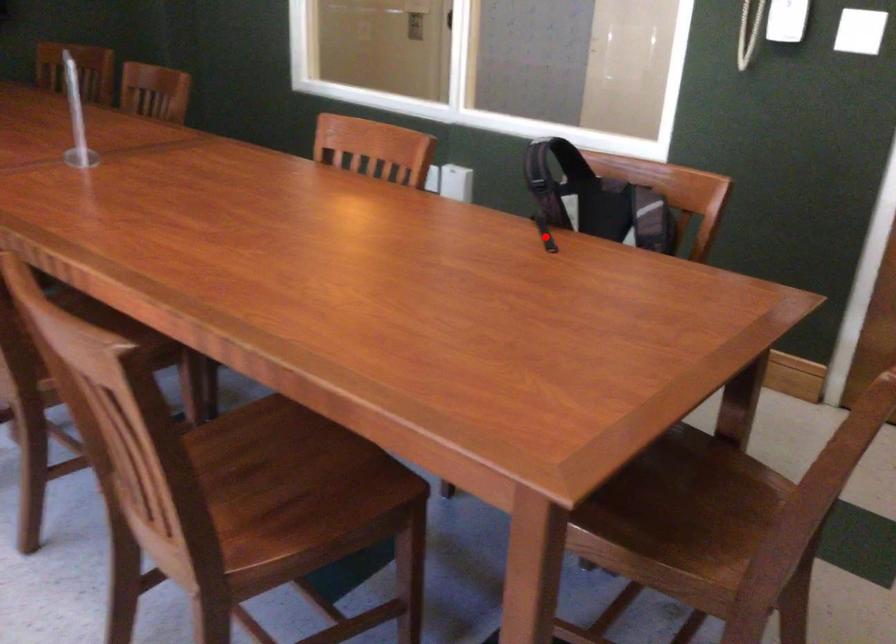
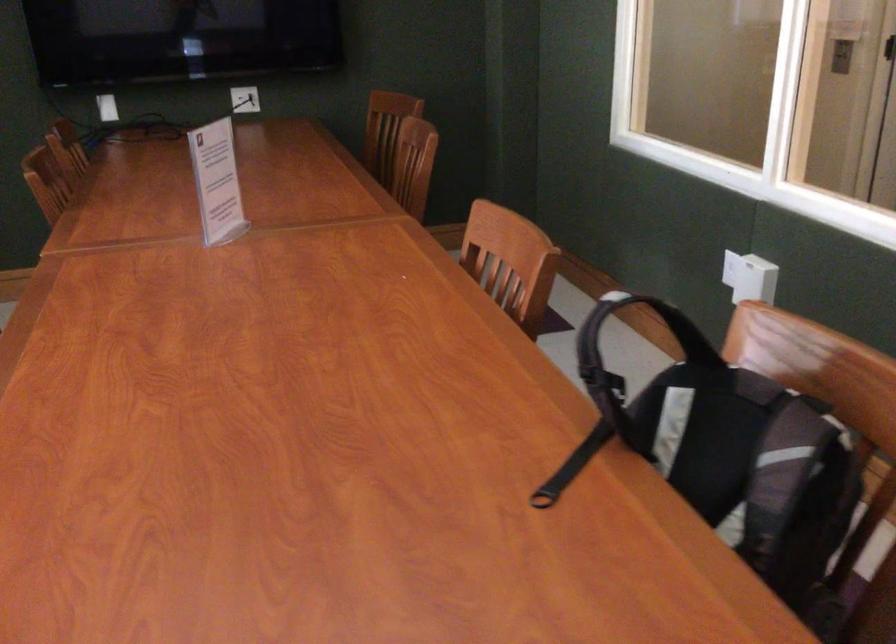
Where in the second image is the point corresponding to the highlighted location from the first image?

(572, 466)